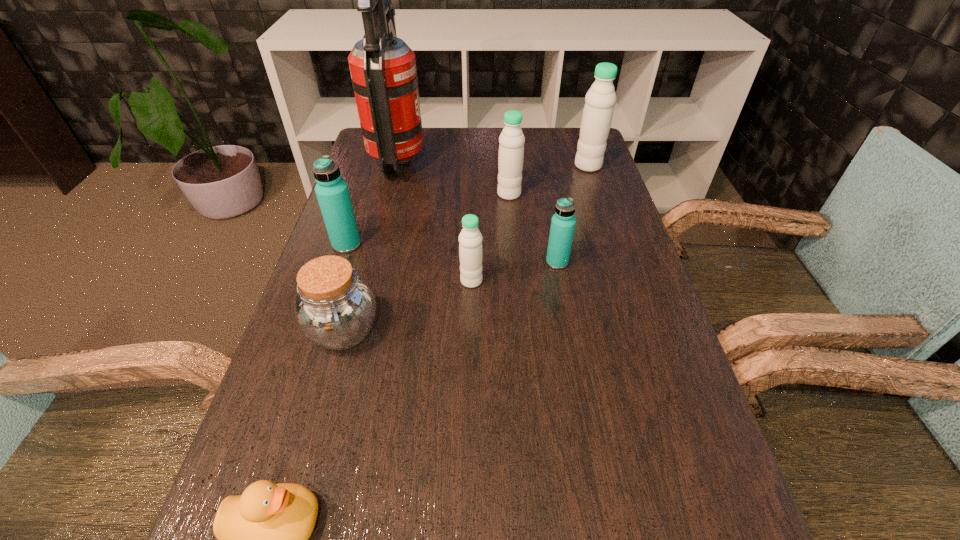
At what (x,y) coordinates should I click in order to perform the action: click on water bottle that is the third closest to the farthest white water bottle. Please return your answer as a coordinate pair (x, y). Looking at the image, I should click on (470, 239).

Where is `water bottle object that ranks as the closest to the third water bottle from right to left`? The width and height of the screenshot is (960, 540). water bottle object that ranks as the closest to the third water bottle from right to left is located at coordinates (600, 99).

Where is `white water bottle that is the third closest to the left blue water bottle`? This screenshot has width=960, height=540. white water bottle that is the third closest to the left blue water bottle is located at coordinates (600, 99).

You are a GUI agent. You are given a task and a screenshot of the screen. Output one action in this format:
    pyautogui.click(x=<x>, y=<y>)
    Task: Click on the white water bottle that stands as the closest to the seventh farthest object
    This screenshot has width=960, height=540.
    Given the screenshot: What is the action you would take?
    pyautogui.click(x=470, y=239)

The image size is (960, 540). I want to click on free location that satisfies the following two spatial constraints: 1. on the front label side of the fire extinguisher; 2. on the front side of the second nearest object, so click(356, 331).

Locate an element on the screen. Image resolution: width=960 pixels, height=540 pixels. vacant position in the image that satisfies the following two spatial constraints: 1. on the front label side of the fire extinguisher; 2. on the front side of the second nearest object is located at coordinates (356, 331).

Image resolution: width=960 pixels, height=540 pixels. I want to click on vacant space that satisfies the following two spatial constraints: 1. on the back side of the nearer blue water bottle; 2. on the right side of the smallest white water bottle, so click(x=471, y=262).

Identify the location of blank space that satisfies the following two spatial constraints: 1. on the back side of the second farthest white water bottle; 2. on the right side of the seventh farthest object. This screenshot has height=540, width=960. tap(381, 194).

The height and width of the screenshot is (540, 960). Identify the location of vacant region that satisfies the following two spatial constraints: 1. on the front label side of the fire extinguisher; 2. on the back side of the nearer blue water bottle. (373, 262).